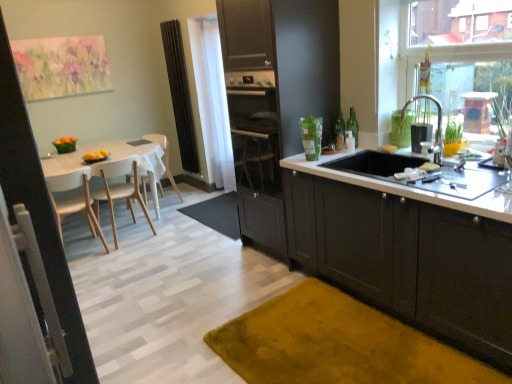
This screenshot has height=384, width=512. In order to click on free space above white wood chair at left, the 3th chair when ordered from back to front (from a real-world perspective) in this screenshot , I will do `click(70, 164)`.